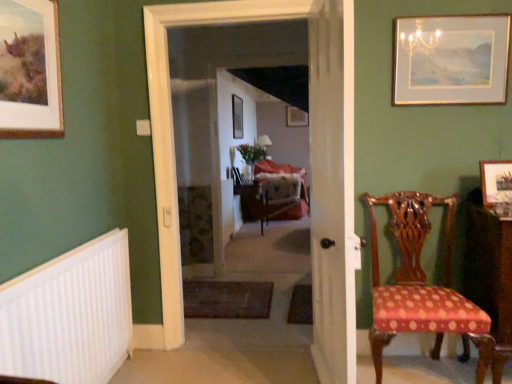
Question: Which direction should I rotate to look at carpeted floor at center, which is the 2th corridor from back to front?

Choices:
 (A) right
 (B) left

Answer: (B)

Question: From a real-world perspective, is wooden picture frame at upper left, positioned as the 5th picture frame in back-to-front order, on top of wooden picture frame at center, the 5th picture frame in the front-to-back sequence?

Choices:
 (A) no
 (B) yes

Answer: (A)

Question: Would you consider wooden picture frame at upper left, marked as the 5th picture frame in a right-to-left arrangement, to be distant from wooden picture frame at center, which ranks as the 3th picture frame in right-to-left order?

Choices:
 (A) no
 (B) yes

Answer: (B)

Question: Is the depth of wooden picture frame at upper left, which is the first picture frame in front-to-back order, less than that of wooden picture frame at center, the third picture frame from the left?

Choices:
 (A) yes
 (B) no

Answer: (A)

Question: Can you confirm if wooden picture frame at upper left, the first picture frame positioned from the left, is thinner than wooden picture frame at center, the 5th picture frame in the front-to-back sequence?

Choices:
 (A) no
 (B) yes

Answer: (A)

Question: Can we say wooden picture frame at upper left, marked as the 5th picture frame in a right-to-left arrangement, lies outside wooden picture frame at center, which ranks as the 3th picture frame in right-to-left order?

Choices:
 (A) yes
 (B) no

Answer: (A)

Question: Is wooden picture frame at upper left, marked as the 5th picture frame in a right-to-left arrangement, wider than wooden picture frame at center, the third picture frame from the left?

Choices:
 (A) no
 (B) yes

Answer: (B)

Question: Considering the relative sizes of white wooden door at center and velvet upholstered swivel chair at center in the image provided, is white wooden door at center smaller than velvet upholstered swivel chair at center?

Choices:
 (A) yes
 (B) no

Answer: (A)

Question: From a real-world perspective, is white wooden door at center under velvet upholstered swivel chair at center?

Choices:
 (A) yes
 (B) no

Answer: (B)

Question: From a real-world perspective, is white wooden door at center on velvet upholstered swivel chair at center?

Choices:
 (A) no
 (B) yes

Answer: (B)

Question: Is white wooden door at center outside velvet upholstered swivel chair at center?

Choices:
 (A) no
 (B) yes

Answer: (B)

Question: Is white wooden door at center surrounding velvet upholstered swivel chair at center?

Choices:
 (A) no
 (B) yes

Answer: (A)

Question: Is white wooden door at center placed right next to velvet upholstered swivel chair at center?

Choices:
 (A) yes
 (B) no

Answer: (B)

Question: Is white plastic radiator at lower left outside velvet upholstered swivel chair at center?

Choices:
 (A) yes
 (B) no

Answer: (A)